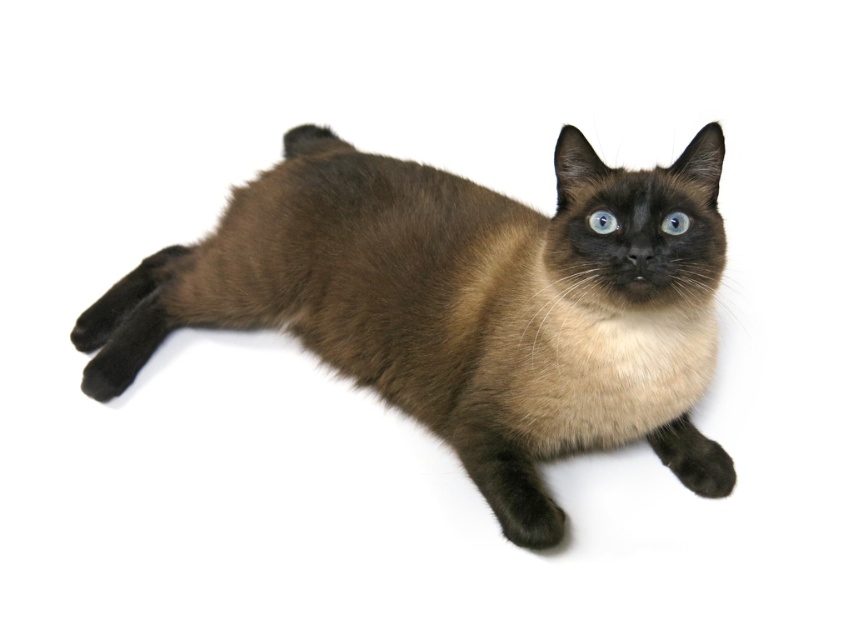
Does brown fur cat at center have a lesser width compared to blue glossy eye at center?

No.

Can you confirm if brown fur cat at center is taller than blue glossy eye at center?

Correct, brown fur cat at center is much taller as blue glossy eye at center.

Who is more distant from viewer, (x=439, y=369) or (x=614, y=228)?

Positioned behind is point (x=439, y=369).

The image size is (853, 640). In order to click on brown fur cat at center in this screenshot , I will do coord(463,305).